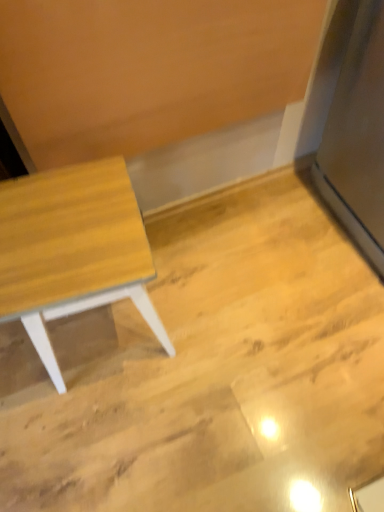
Identify the location of vacant point above light wood table at left (from a real-world perspective). Image resolution: width=384 pixels, height=512 pixels. coord(58,230).